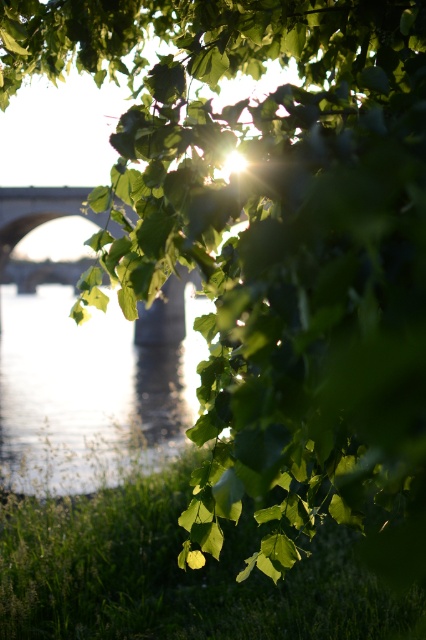
You are standing at the riverside and want to place a small picnic basket on the green leafy grass at lower left. However, you also have a larger cooler that needs to be placed on the clear water at center. Will both items fit on their respective spots?

The green leafy grass at lower left has a smaller width than the clear water at center. The picnic basket might fit on the grass, but the cooler may not fit on the water since water cannot support heavy objects. However, the question specifies placing the cooler on the water, which is not feasible as water surfaces cannot hold heavy items. Therefore, neither placement is advisable.

You are standing at the center of the image and want to place a small decorative rock at the exact location of the green leafy grass at lower left. What are the coordinates where you should place the rock?

The coordinates for the green leafy grass at lower left are at point [178,573], so you should place the rock there.